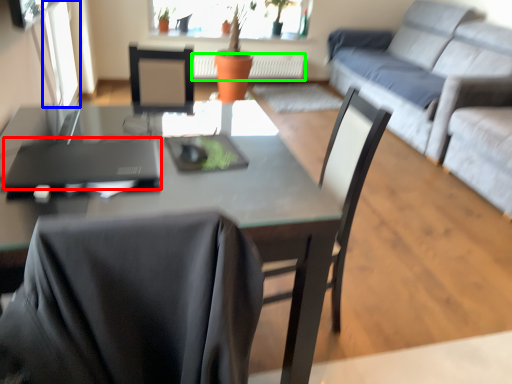
Question: Which is farther away from laptop (highlighted by a red box)? window screen (highlighted by a blue box) or radiator (highlighted by a green box)?

Choices:
 (A) window screen
 (B) radiator

Answer: (B)